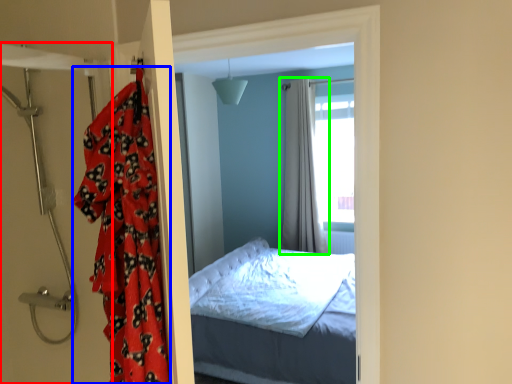
Question: Which object is positioned closest to door (highlighted by a red box)? Select from blanket (highlighted by a blue box) and curtain (highlighted by a green box).

Choices:
 (A) blanket
 (B) curtain

Answer: (A)